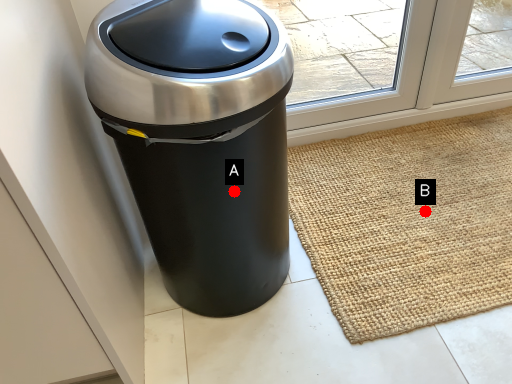
Question: Two points are circled on the image, labeled by A and B beside each circle. Which point is farther from the camera taking this photo?

Choices:
 (A) A is further
 (B) B is further

Answer: (B)